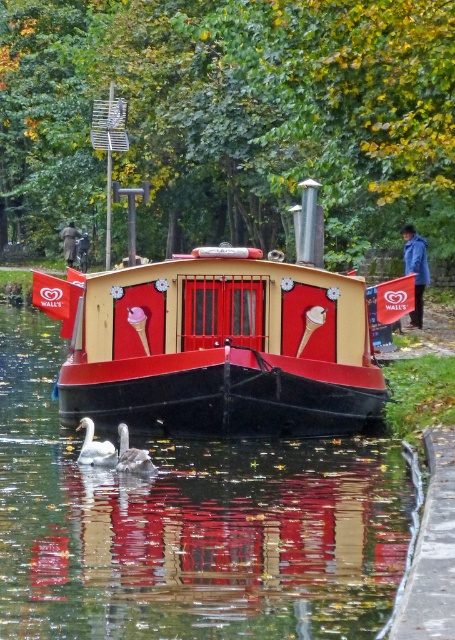
Can you confirm if smooth black water at center is thinner than matte red boat at center?

In fact, smooth black water at center might be wider than matte red boat at center.

Who is positioned more to the right, smooth black water at center or matte red boat at center?

From the viewer's perspective, smooth black water at center appears more on the right side.

Who is more forward, (342,536) or (320,276)?

Point (342,536) is in front.

Image resolution: width=455 pixels, height=640 pixels. I want to click on smooth black water at center, so click(187, 525).

Who is higher up, blue fabric jacket at right or white matte duck at lower center?

blue fabric jacket at right

Does point (413, 240) lie behind point (131, 456)?

Yes, it is behind point (131, 456).

The height and width of the screenshot is (640, 455). Find the location of `blue fabric jacket at right`. blue fabric jacket at right is located at coordinates (415, 269).

Is smooth black water at center further to camera compared to white matte duck at lower center?

No, smooth black water at center is closer to the viewer.

Can you confirm if smooth black water at center is wider than white matte duck at lower center?

Yes, smooth black water at center is wider than white matte duck at lower center.

What do you see at coordinates (187, 525) in the screenshot? The height and width of the screenshot is (640, 455). I see `smooth black water at center` at bounding box center [187, 525].

Locate an element on the screen. The width and height of the screenshot is (455, 640). smooth black water at center is located at coordinates (187, 525).